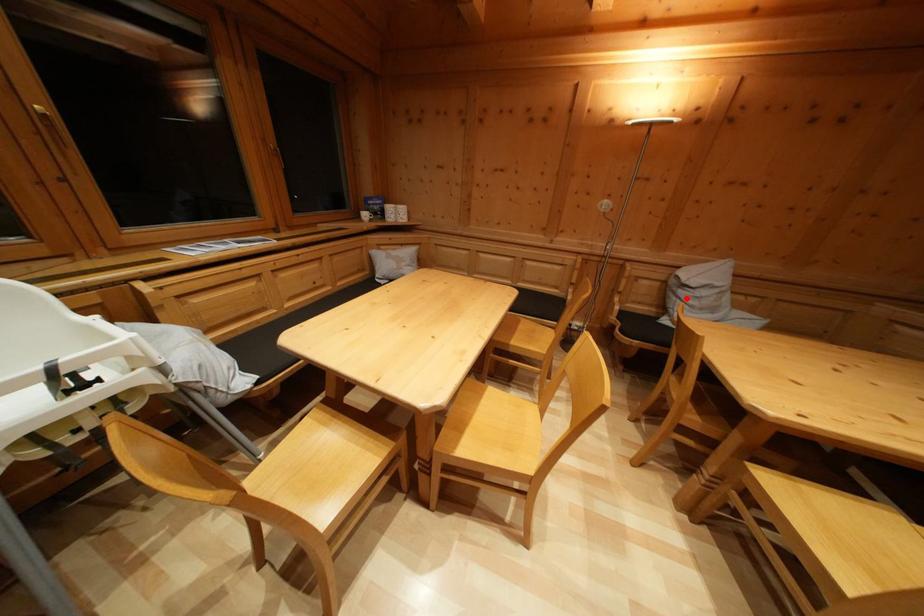
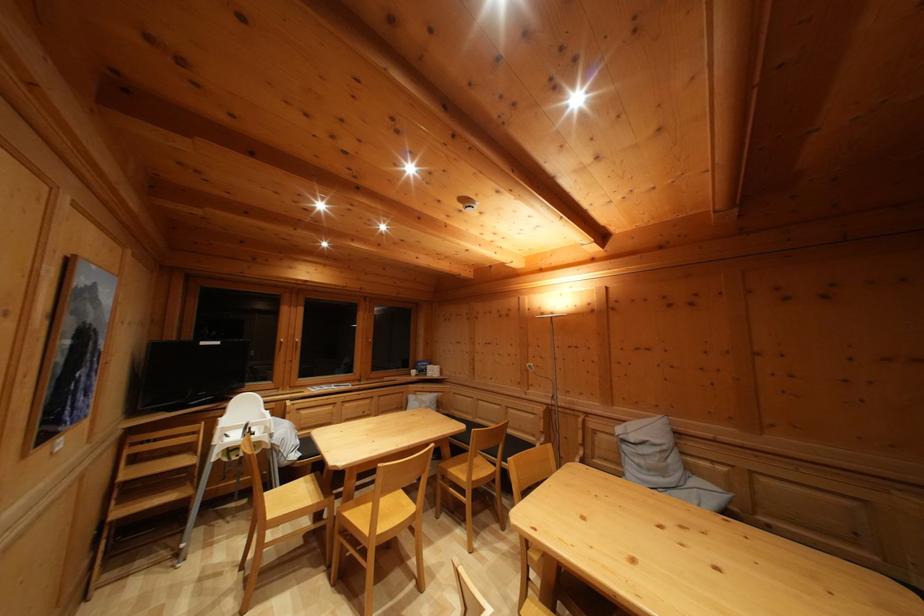
Where in the second image is the point corresponding to the highlighted location from the first image?

(629, 454)